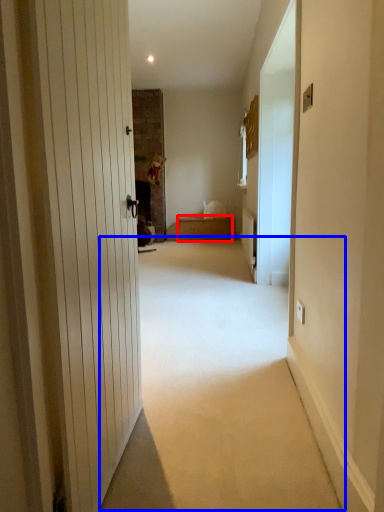
Question: Which object is further to the camera taking this photo, furniture (highlighted by a red box) or corridor (highlighted by a blue box)?

Choices:
 (A) furniture
 (B) corridor

Answer: (A)